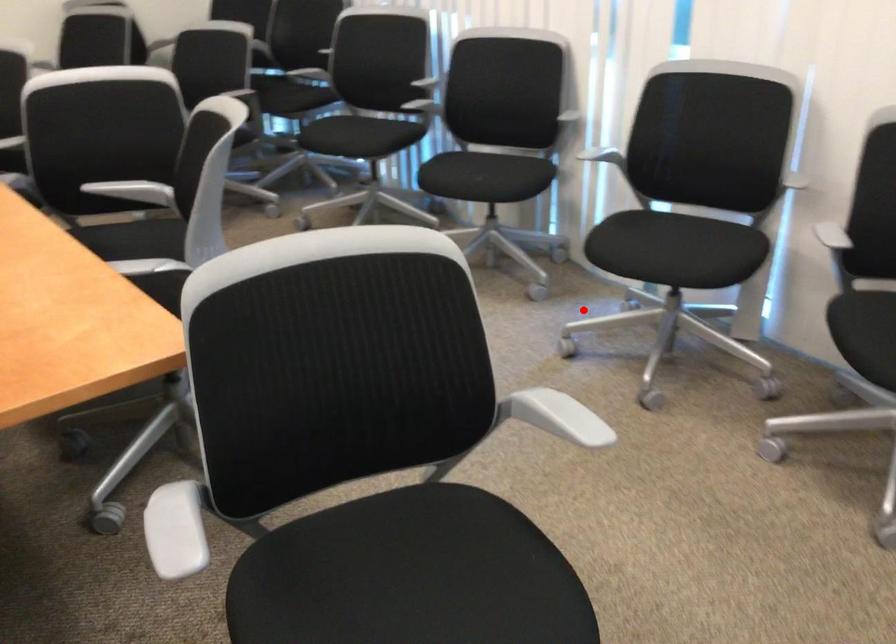
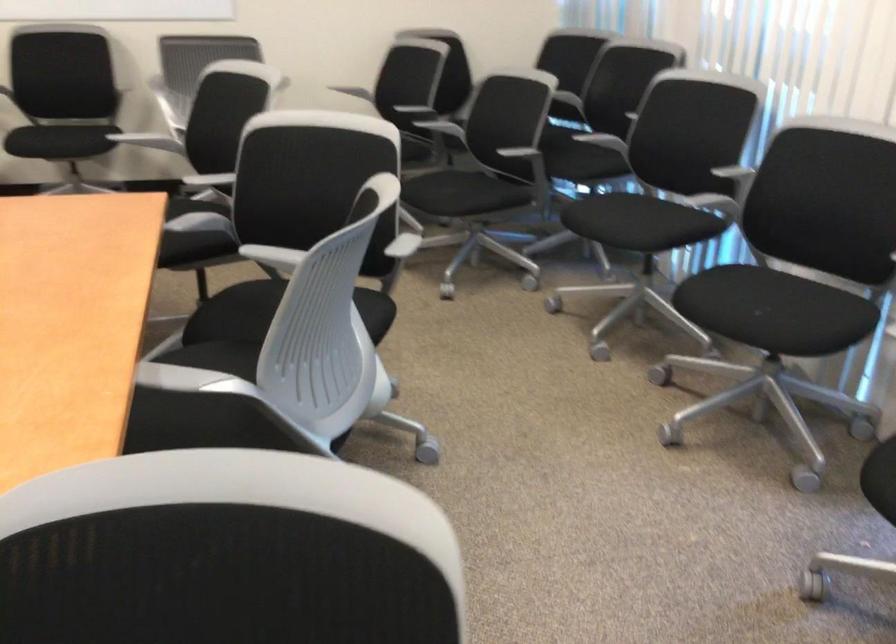
Where in the second image is the point corresponding to the highlighted location from the first image?

(858, 527)